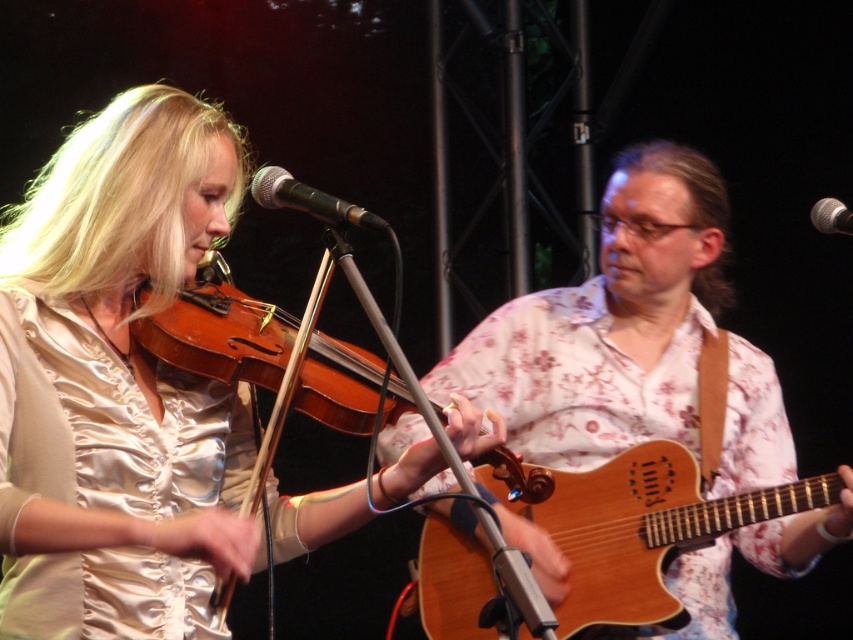
Question: Observing the image, what is the correct spatial positioning of light brown wooden guitar at center in reference to wooden violin at center?

Choices:
 (A) above
 (B) below

Answer: (B)

Question: Does wooden violin at center appear over metallic silver microphone at center?

Choices:
 (A) no
 (B) yes

Answer: (A)

Question: Which point is farther to the camera?

Choices:
 (A) wooden acoustic guitar at center
 (B) metallic silver microphone at center
 (C) black metallic microphone at center
 (D) light brown wooden guitar at center

Answer: (A)

Question: Is wooden acoustic guitar at center thinner than metallic silver microphone at center?

Choices:
 (A) no
 (B) yes

Answer: (A)

Question: Among these points, which one is farthest from the camera?

Choices:
 (A) (825, 480)
 (B) (811, 218)

Answer: (A)

Question: Among these objects, which one is nearest to the camera?

Choices:
 (A) wooden violin at center
 (B) black metallic microphone at center
 (C) metallic silver microphone at center
 (D) wooden acoustic guitar at center

Answer: (A)